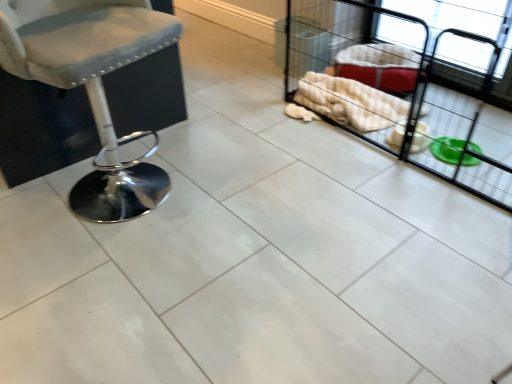
In order to face matte gray fabric stool at left, should I rotate leftwards or rightwards?

Turn left approximately 20.953 degrees to face it.

What is the approximate height of matte gray fabric stool at left?

matte gray fabric stool at left is 31.57 inches in height.

Find the location of a particular element. Image resolution: width=512 pixels, height=384 pixels. matte gray fabric stool at left is located at coordinates (92, 85).

What do you see at coordinates (92, 85) in the screenshot?
I see `matte gray fabric stool at left` at bounding box center [92, 85].

What do you see at coordinates (401, 91) in the screenshot? I see `white fabric baby carriage at right` at bounding box center [401, 91].

In order to face white fabric baby carriage at right, should I rotate leftwards or rightwards?

Turn right by 21.835 degrees to look at white fabric baby carriage at right.

Measure the distance between point (455, 41) and camera.

Point (455, 41) and camera are 2.92 meters apart from each other.

Identify the location of white fabric baby carriage at right. (401, 91).

Find the location of a particular element. matte gray fabric stool at left is located at coordinates (92, 85).

Considering the relative positions of matte gray fabric stool at left and white fabric baby carriage at right in the image provided, is matte gray fabric stool at left to the left of white fabric baby carriage at right from the viewer's perspective?

Yes.

Which object is closer to the camera taking this photo, matte gray fabric stool at left or white fabric baby carriage at right?

matte gray fabric stool at left.

Which is in front, point (89, 78) or point (390, 53)?

Positioned in front is point (89, 78).

From the picture: From the image's perspective, is matte gray fabric stool at left beneath white fabric baby carriage at right?

Indeed, from the image's perspective, matte gray fabric stool at left is shown beneath white fabric baby carriage at right.

In the scene shown: From a real-world perspective, is matte gray fabric stool at left positioned above or below white fabric baby carriage at right?

From a real-world perspective, matte gray fabric stool at left is physically above white fabric baby carriage at right.

Is matte gray fabric stool at left thinner than white fabric baby carriage at right?

Yes.

Does matte gray fabric stool at left have a lesser height compared to white fabric baby carriage at right?

In fact, matte gray fabric stool at left may be taller than white fabric baby carriage at right.

Can you confirm if matte gray fabric stool at left is bigger than white fabric baby carriage at right?

No.

Would you say matte gray fabric stool at left is inside or outside white fabric baby carriage at right?

matte gray fabric stool at left lies outside white fabric baby carriage at right.

Based on the photo, are matte gray fabric stool at left and white fabric baby carriage at right located far from each other?

Absolutely, matte gray fabric stool at left is distant from white fabric baby carriage at right.

Could you tell me if matte gray fabric stool at left is turned towards white fabric baby carriage at right?

No, matte gray fabric stool at left is not facing towards white fabric baby carriage at right.

How different are the orientations of matte gray fabric stool at left and white fabric baby carriage at right in degrees?

The angular difference between matte gray fabric stool at left and white fabric baby carriage at right is 103 degrees.

Where is `baby carriage behind the matte gray fabric stool at left`? The image size is (512, 384). baby carriage behind the matte gray fabric stool at left is located at coordinates (401, 91).

Is white fabric baby carriage at right to the left of matte gray fabric stool at left from the viewer's perspective?

Incorrect, white fabric baby carriage at right is not on the left side of matte gray fabric stool at left.

In the image, is white fabric baby carriage at right positioned in front of or behind matte gray fabric stool at left?

white fabric baby carriage at right is positioned farther from the viewer than matte gray fabric stool at left.

Is point (300, 46) closer to camera compared to point (101, 127)?

No.

From the image's perspective, is white fabric baby carriage at right beneath matte gray fabric stool at left?

No.

From a real-world perspective, between white fabric baby carriage at right and matte gray fabric stool at left, who is vertically lower?

white fabric baby carriage at right.

Considering the relative sizes of white fabric baby carriage at right and matte gray fabric stool at left in the image provided, is white fabric baby carriage at right wider than matte gray fabric stool at left?

Yes.

In terms of height, does white fabric baby carriage at right look taller or shorter compared to matte gray fabric stool at left?

Considering their sizes, white fabric baby carriage at right has less height than matte gray fabric stool at left.

Can you confirm if white fabric baby carriage at right is smaller than matte gray fabric stool at left?

Actually, white fabric baby carriage at right might be larger than matte gray fabric stool at left.

Is white fabric baby carriage at right outside of matte gray fabric stool at left?

Yes, white fabric baby carriage at right is not within matte gray fabric stool at left.

Is white fabric baby carriage at right with matte gray fabric stool at left?

No, white fabric baby carriage at right is not next to matte gray fabric stool at left.

Is white fabric baby carriage at right oriented towards matte gray fabric stool at left?

Yes.

What's the angular difference between white fabric baby carriage at right and matte gray fabric stool at left's facing directions?

white fabric baby carriage at right and matte gray fabric stool at left are facing 103 degrees away from each other.

Measure the distance from white fabric baby carriage at right to matte gray fabric stool at left.

white fabric baby carriage at right is 4.49 feet away from matte gray fabric stool at left.

Find the location of a particular element. This screenshot has width=512, height=384. baby carriage on the right of matte gray fabric stool at left is located at coordinates (401, 91).

At what (x,y) coordinates should I click in order to perform the action: click on chair in front of the white fabric baby carriage at right. Please return your answer as a coordinate pair (x, y). Looking at the image, I should click on (92, 85).

In the image, there is a white fabric baby carriage at right. Identify the location of chair below it (from the image's perspective). This screenshot has height=384, width=512. (92, 85).